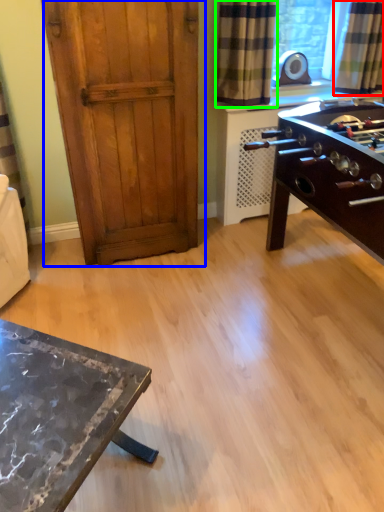
Question: Based on their relative distances, which object is farther from curtain (highlighted by a red box)? Choose from door (highlighted by a blue box) and curtain (highlighted by a green box).

Choices:
 (A) door
 (B) curtain

Answer: (A)